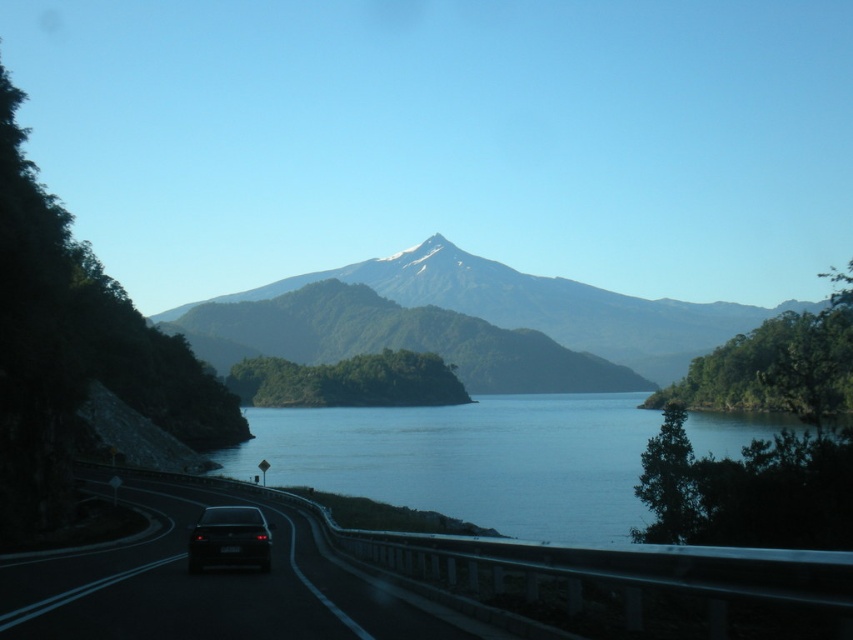
Question: Based on their relative distances, which object is farther from the black glossy car at lower left?

Choices:
 (A) green textured mountain at center
 (B) black asphalt highway at lower left
 (C) blue water at center

Answer: (A)

Question: In this image, where is green textured mountain at center located relative to black glossy car at lower left?

Choices:
 (A) above
 (B) below

Answer: (A)

Question: Which point is closer to the camera?

Choices:
 (A) (610, 509)
 (B) (233, 524)

Answer: (B)

Question: Which object is the closest to the blue water at center?

Choices:
 (A) black glossy car at lower left
 (B) green textured mountain at center

Answer: (A)

Question: Is blue water at center smaller than green textured mountain at center?

Choices:
 (A) no
 (B) yes

Answer: (B)

Question: Is green textured mountain at center wider than black glossy car at lower left?

Choices:
 (A) yes
 (B) no

Answer: (A)